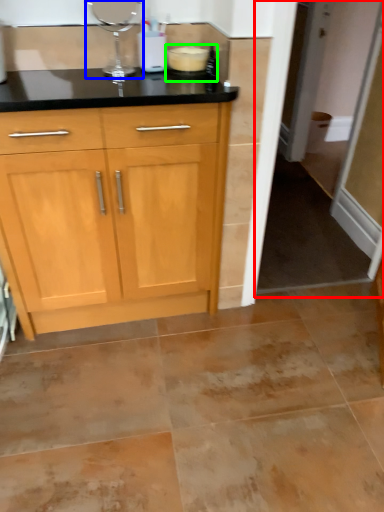
Question: Considering the real-world distances, which object is closest to screen door (highlighted by a red box)? appliance (highlighted by a blue box) or appliance (highlighted by a green box).

Choices:
 (A) appliance
 (B) appliance

Answer: (B)